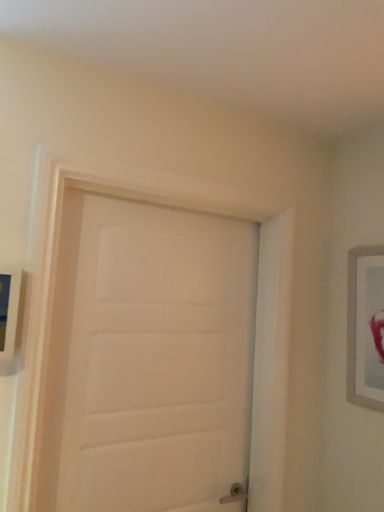
Find the location of `wooden picture frame at left, the 1th picture frame in the left-to-right sequence`. wooden picture frame at left, the 1th picture frame in the left-to-right sequence is located at coordinates (10, 311).

Locate an element on the screen. Image resolution: width=384 pixels, height=512 pixels. silver metallic picture frame at right, which is the 1th picture frame from back to front is located at coordinates (366, 327).

The image size is (384, 512). I want to click on wooden picture frame at left, arranged as the 2th picture frame when viewed from the back, so click(x=10, y=311).

Does silver metallic picture frame at right, which is the 2th picture frame in front-to-back order, appear on the left side of white matte door at center?

No.

Measure the distance between silver metallic picture frame at right, which is the 1th picture frame from back to front, and white matte door at center.

silver metallic picture frame at right, which is the 1th picture frame from back to front, and white matte door at center are 26.88 inches apart.

Considering the sizes of objects silver metallic picture frame at right, which appears as the second picture frame when viewed from the left, and white matte door at center in the image provided, who is smaller, silver metallic picture frame at right, which appears as the second picture frame when viewed from the left, or white matte door at center?

silver metallic picture frame at right, which appears as the second picture frame when viewed from the left.

Between silver metallic picture frame at right, which appears as the second picture frame when viewed from the left, and white matte door at center, which one has less height?

silver metallic picture frame at right, which appears as the second picture frame when viewed from the left.

Is wooden picture frame at left, the 1th picture frame from the front, not close to white matte door at center?

No, there isn't a large distance between wooden picture frame at left, the 1th picture frame from the front, and white matte door at center.

Is wooden picture frame at left, the 2th picture frame when ordered from right to left, not within white matte door at center?

Absolutely, wooden picture frame at left, the 2th picture frame when ordered from right to left, is external to white matte door at center.

Considering the relative sizes of wooden picture frame at left, the 2th picture frame when ordered from right to left, and white matte door at center in the image provided, is wooden picture frame at left, the 2th picture frame when ordered from right to left, taller than white matte door at center?

No, wooden picture frame at left, the 2th picture frame when ordered from right to left, is not taller than white matte door at center.

Measure the distance from wooden picture frame at left, the 1th picture frame in the left-to-right sequence, to white matte door at center.

The distance of wooden picture frame at left, the 1th picture frame in the left-to-right sequence, from white matte door at center is 20.42 inches.

Based on their positions, is white matte door at center located to the left or right of silver metallic picture frame at right, which is the 2th picture frame in front-to-back order?

In the image, white matte door at center appears on the left side of silver metallic picture frame at right, which is the 2th picture frame in front-to-back order.

Which of these two, white matte door at center or silver metallic picture frame at right, which is the 2th picture frame in front-to-back order, is smaller?

silver metallic picture frame at right, which is the 2th picture frame in front-to-back order.

Locate an element on the screen. door that is under the silver metallic picture frame at right, which is the 1th picture frame from back to front (from a real-world perspective) is located at coordinates (152, 355).

From the image's perspective, which one is positioned lower, white matte door at center or silver metallic picture frame at right, which is the 1th picture frame from back to front?

From the image's view, white matte door at center is below.

From their relative heights in the image, would you say white matte door at center is taller or shorter than wooden picture frame at left, arranged as the 2th picture frame when viewed from the back?

Considering their sizes, white matte door at center has more height than wooden picture frame at left, arranged as the 2th picture frame when viewed from the back.

Would you say white matte door at center is a long distance from wooden picture frame at left, the 1th picture frame from the front?

No, white matte door at center is not far away from wooden picture frame at left, the 1th picture frame from the front.

The width and height of the screenshot is (384, 512). Find the location of `picture frame in front of the white matte door at center`. picture frame in front of the white matte door at center is located at coordinates (10, 311).

Considering their positions, is white matte door at center located in front of or behind wooden picture frame at left, the 1th picture frame from the front?

In the image, white matte door at center appears behind wooden picture frame at left, the 1th picture frame from the front.

Would you say silver metallic picture frame at right, which is the 1th picture frame from back to front, is to the left or to the right of wooden picture frame at left, the 1th picture frame in the left-to-right sequence, in the picture?

silver metallic picture frame at right, which is the 1th picture frame from back to front, is positioned on wooden picture frame at left, the 1th picture frame in the left-to-right sequence,'s right side.

From the image's perspective, which one is positioned lower, silver metallic picture frame at right, which appears as the second picture frame when viewed from the left, or wooden picture frame at left, the 1th picture frame in the left-to-right sequence?

silver metallic picture frame at right, which appears as the second picture frame when viewed from the left, appears lower in the image.

Does silver metallic picture frame at right, which is the 2th picture frame in front-to-back order, touch wooden picture frame at left, the 1th picture frame from the front?

They are not placed beside each other.

From the picture: In terms of height, does silver metallic picture frame at right, which is the 2th picture frame in front-to-back order, look taller or shorter compared to wooden picture frame at left, the 2th picture frame when ordered from right to left?

Considering their sizes, silver metallic picture frame at right, which is the 2th picture frame in front-to-back order, has more height than wooden picture frame at left, the 2th picture frame when ordered from right to left.

Which object is positioned more to the right, wooden picture frame at left, the 1th picture frame from the front, or silver metallic picture frame at right, which is the 1th picture frame from back to front?

silver metallic picture frame at right, which is the 1th picture frame from back to front.

How different are the orientations of wooden picture frame at left, arranged as the 2th picture frame when viewed from the back, and silver metallic picture frame at right, which is the 2th picture frame in front-to-back order, in degrees?

The facing directions of wooden picture frame at left, arranged as the 2th picture frame when viewed from the back, and silver metallic picture frame at right, which is the 2th picture frame in front-to-back order, are 89.6 degrees apart.

From the image's perspective, is wooden picture frame at left, arranged as the 2th picture frame when viewed from the back, located above silver metallic picture frame at right, which is the 2th picture frame in front-to-back order?

Yes, from the image's perspective, wooden picture frame at left, arranged as the 2th picture frame when viewed from the back, is above silver metallic picture frame at right, which is the 2th picture frame in front-to-back order.

From a real-world perspective, is wooden picture frame at left, the 2th picture frame when ordered from right to left, above or below silver metallic picture frame at right, which appears as the first picture frame when viewed from the right?

In terms of real-world spatial position, wooden picture frame at left, the 2th picture frame when ordered from right to left, is above silver metallic picture frame at right, which appears as the first picture frame when viewed from the right.

Find the location of a particular element. The image size is (384, 512). picture frame on the right of the white matte door at center is located at coordinates (366, 327).

Where is `the 2nd picture frame located above the white matte door at center (from a real-world perspective)`? This screenshot has height=512, width=384. the 2nd picture frame located above the white matte door at center (from a real-world perspective) is located at coordinates (10, 311).

When comparing their distances from wooden picture frame at left, the 1th picture frame in the left-to-right sequence, does white matte door at center or silver metallic picture frame at right, which appears as the second picture frame when viewed from the left, seem further?

silver metallic picture frame at right, which appears as the second picture frame when viewed from the left.

From the image, which object appears to be nearer to wooden picture frame at left, the 1th picture frame from the front, silver metallic picture frame at right, which is the 1th picture frame from back to front, or white matte door at center?

Based on the image, white matte door at center appears to be nearer to wooden picture frame at left, the 1th picture frame from the front.

Based on their spatial positions, is silver metallic picture frame at right, which appears as the second picture frame when viewed from the left, or wooden picture frame at left, the 2th picture frame when ordered from right to left, further from white matte door at center?

Based on the image, silver metallic picture frame at right, which appears as the second picture frame when viewed from the left, appears to be further to white matte door at center.

When comparing their distances from white matte door at center, does wooden picture frame at left, the 1th picture frame from the front, or silver metallic picture frame at right, which is the 1th picture frame from back to front, seem further?

silver metallic picture frame at right, which is the 1th picture frame from back to front, is further to white matte door at center.

Estimate the real-world distances between objects in this image. Which object is closer to silver metallic picture frame at right, which is the 2th picture frame in front-to-back order, white matte door at center or wooden picture frame at left, arranged as the 2th picture frame when viewed from the back?

white matte door at center lies closer to silver metallic picture frame at right, which is the 2th picture frame in front-to-back order, than the other object.

Based on their spatial positions, is wooden picture frame at left, the 2th picture frame when ordered from right to left, or white matte door at center closer to silver metallic picture frame at right, which is the 1th picture frame from back to front?

white matte door at center is closer to silver metallic picture frame at right, which is the 1th picture frame from back to front.

Locate an element on the screen. door situated between wooden picture frame at left, the 1th picture frame from the front, and silver metallic picture frame at right, which is the 2th picture frame in front-to-back order, from left to right is located at coordinates (x=152, y=355).